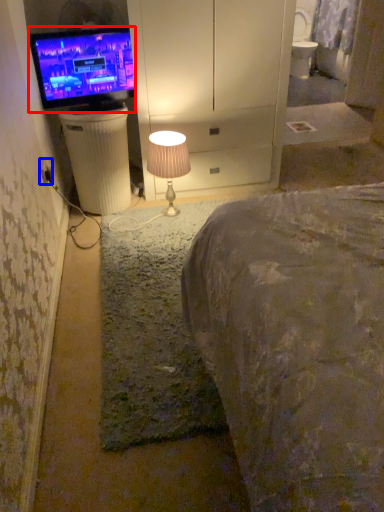
Question: Which object appears farthest to the camera in this image, television (highlighted by a red box) or electric outlet (highlighted by a blue box)?

Choices:
 (A) television
 (B) electric outlet

Answer: (A)